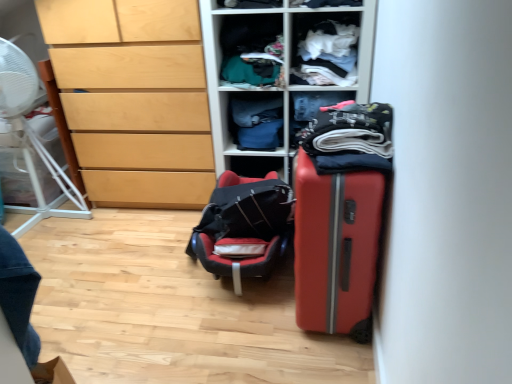
Identify the location of vacant region under white plastic fan at left (from a real-world perspective). Image resolution: width=512 pixels, height=384 pixels. (42, 219).